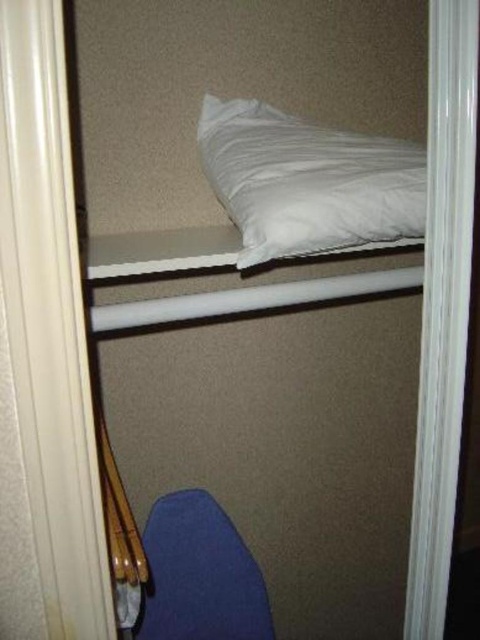
This screenshot has width=480, height=640. What do you see at coordinates (309, 182) in the screenshot?
I see `white soft pillow at upper center` at bounding box center [309, 182].

Is point (283, 176) positioned after point (210, 504)?

No.

The image size is (480, 640). I want to click on white soft pillow at upper center, so click(x=309, y=182).

In the scene shown: Can you confirm if blue fabric chair at lower center is positioned below white matte pillow at upper center?

Indeed, blue fabric chair at lower center is positioned under white matte pillow at upper center.

Identify the location of blue fabric chair at lower center. The height and width of the screenshot is (640, 480). (200, 573).

Can you confirm if white soft pillow at upper center is positioned below white matte pillow at upper center?

Actually, white soft pillow at upper center is above white matte pillow at upper center.

Does point (249, 211) come farther from viewer compared to point (173, 260)?

Yes.

Who is more forward, [276,141] or [282,291]?

Point [282,291] is in front.

At what (x,y) coordinates should I click in order to perform the action: click on white soft pillow at upper center. Please return your answer as a coordinate pair (x, y). This screenshot has height=640, width=480. Looking at the image, I should click on (309, 182).